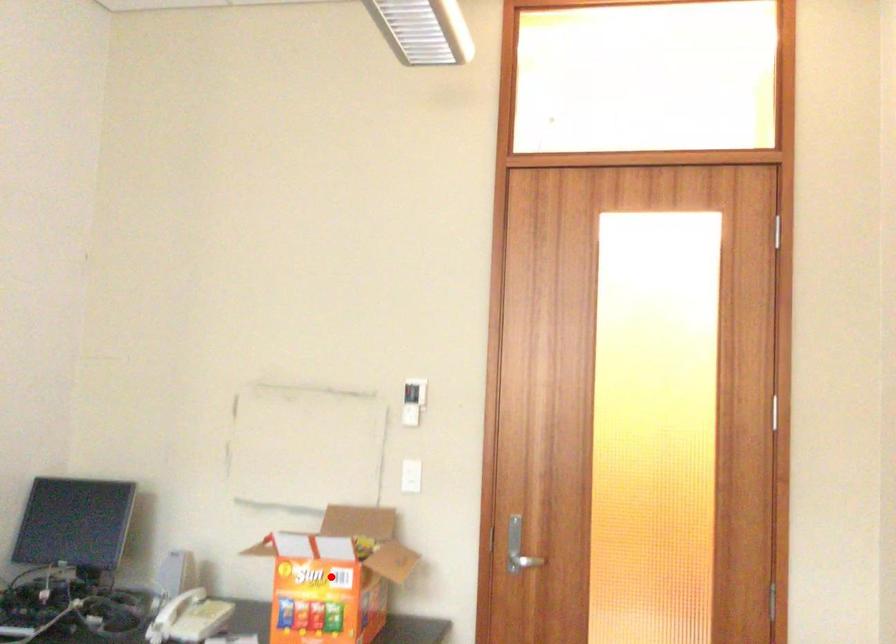
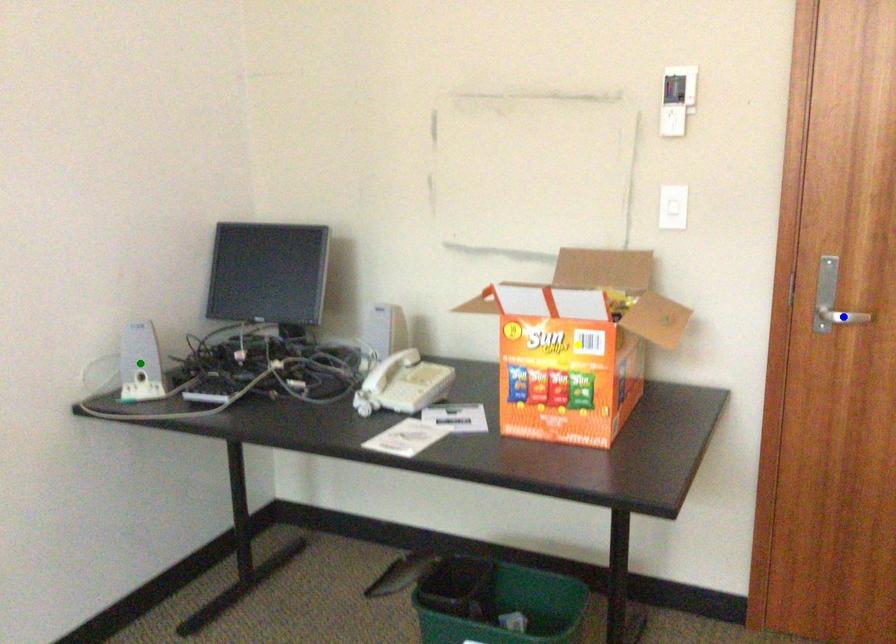
Question: I am providing you with two images of the same scene from different viewpoints. A red point is marked on the first image. You are given multiple points on the second image. Which spot in image 2 lines up with the point in image 1?

Choices:
 (A) blue point
 (B) green point
 (C) yellow point

Answer: (C)